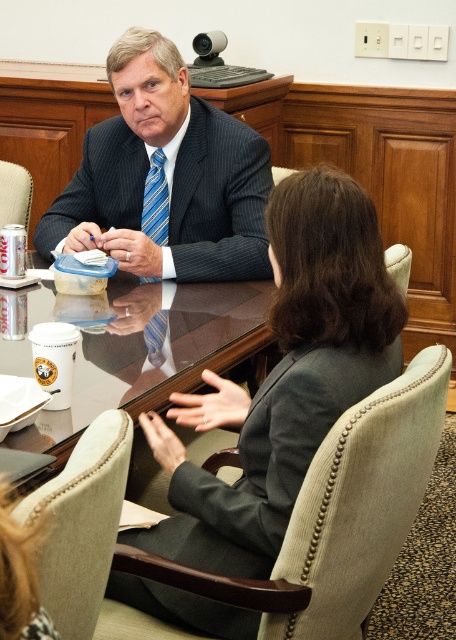
Is dark gray fabric business suit at center to the right of blue striped tie at center from the viewer's perspective?

Yes, dark gray fabric business suit at center is to the right of blue striped tie at center.

Where is `dark gray fabric business suit at center`? dark gray fabric business suit at center is located at coordinates pos(265,461).

Is dark gray fabric business suit at center below dark blue pinstripe suit at center?

Correct, dark gray fabric business suit at center is located below dark blue pinstripe suit at center.

Is dark gray fabric business suit at center smaller than dark blue pinstripe suit at center?

Yes.

Which is in front, point (291, 448) or point (217, 211)?

Positioned in front is point (291, 448).

In order to click on dark gray fabric business suit at center in this screenshot , I will do coord(265,461).

Between point (141, 330) and point (160, 216), which one is positioned behind?

The point (160, 216) is behind.

Is glossy wood round table at center wider than blue striped tie at center?

Correct, the width of glossy wood round table at center exceeds that of blue striped tie at center.

What do you see at coordinates (119, 356) in the screenshot? I see `glossy wood round table at center` at bounding box center [119, 356].

Locate an element on the screen. This screenshot has width=456, height=640. glossy wood round table at center is located at coordinates (119, 356).